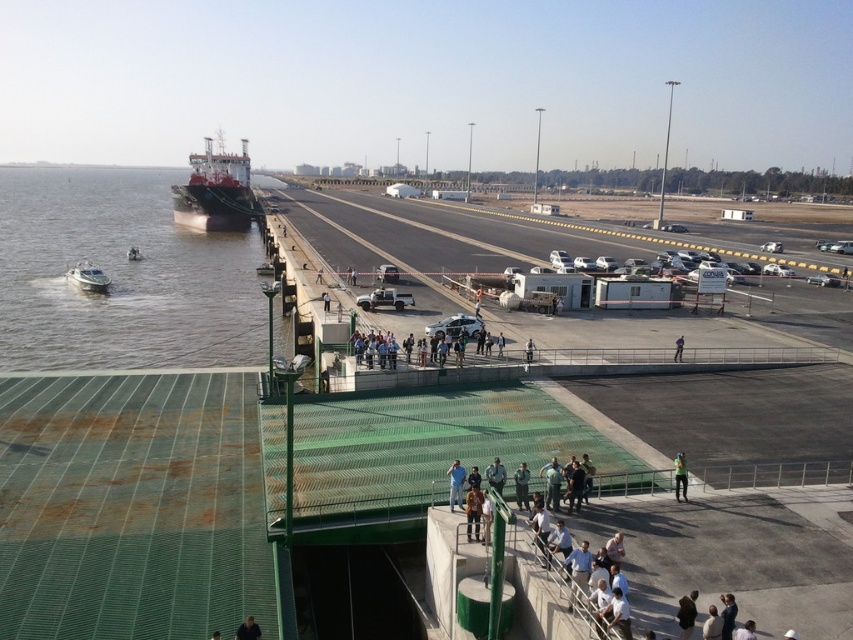
Can you confirm if light blue shirt at center is positioned to the right of white fabric shirt at lower right?

In fact, light blue shirt at center is to the left of white fabric shirt at lower right.

In the scene shown: Is light blue shirt at center taller than white fabric shirt at lower right?

Yes, light blue shirt at center is taller than white fabric shirt at lower right.

Which is behind, point (460, 474) or point (752, 634)?

Positioned behind is point (460, 474).

This screenshot has width=853, height=640. I want to click on light blue shirt at center, so 456,484.

Is brown leather jacket at center closer to the viewer compared to green mesh fence at center?

That is True.

Is brown leather jacket at center above green mesh fence at center?

No, brown leather jacket at center is not above green mesh fence at center.

Is point (473, 513) farther from camera compared to point (532, 349)?

That is False.

Image resolution: width=853 pixels, height=640 pixels. I want to click on brown leather jacket at center, so click(473, 512).

Is the position of light blue shirt at center more distant than that of green fabric at center?

That is False.

Does light blue shirt at center have a smaller size compared to green fabric at center?

Correct, light blue shirt at center occupies less space than green fabric at center.

Find the location of a particular element. light blue shirt at center is located at coordinates (456, 484).

Locate an element on the screen. The image size is (853, 640). light blue shirt at center is located at coordinates (456, 484).